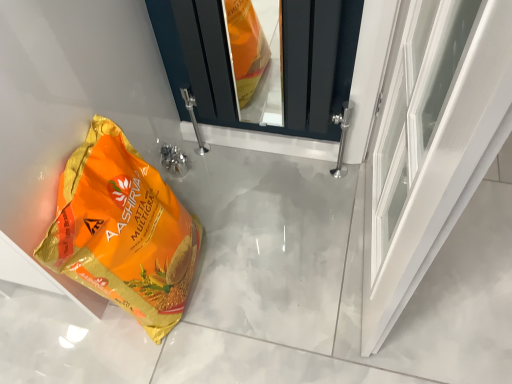
The height and width of the screenshot is (384, 512). Describe the element at coordinates (123, 231) in the screenshot. I see `orange matte plastic bag at lower left` at that location.

You are a GUI agent. You are given a task and a screenshot of the screen. Output one action in this format:
    pyautogui.click(x=<x>, y=<y>)
    Task: Click on the orange matte plastic bag at lower left
    This screenshot has width=512, height=384.
    Given the screenshot: What is the action you would take?
    pyautogui.click(x=123, y=231)

Measure the distance between point (153, 266) and camera.

Point (153, 266) and camera are 36.97 inches apart from each other.

Where is `orange matte plastic bag at lower left`? This screenshot has height=384, width=512. orange matte plastic bag at lower left is located at coordinates (123, 231).